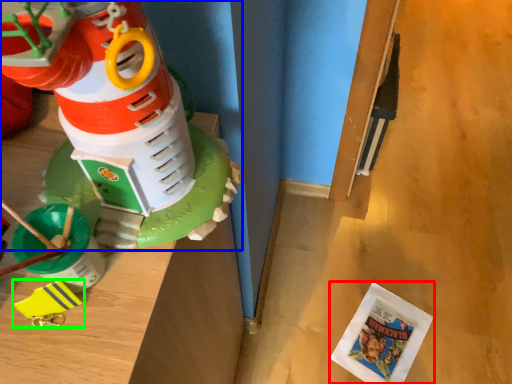
Question: Which is farther away from comic book (highlighted by a red box)? toy (highlighted by a blue box) or toy (highlighted by a green box)?

Choices:
 (A) toy
 (B) toy

Answer: (B)